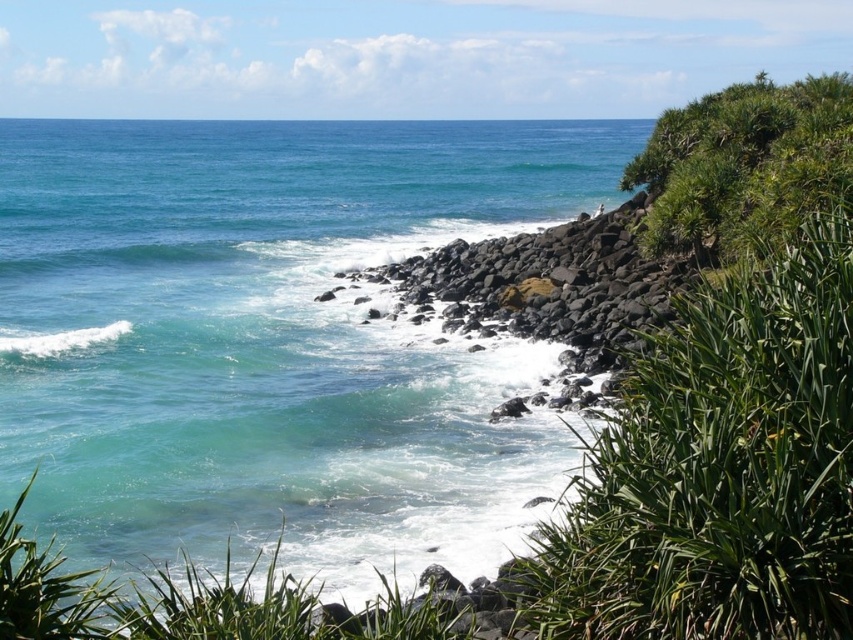
You are standing on the rocky shoreline and want to reach the green leafy plant at right. The teal water at center is between you and the plant. Can you walk directly to the plant without crossing the water?

The teal water at center is 78.12 meters away from the green leafy plant at right. Since the water is between you and the plant, you would need to walk around it or find another path to reach the plant without crossing the water.

You are a drone operator trying to capture the exact center of the teal water at center in the coastal scene. According to the coordinates provided, what are the precise 2D coordinates where you should aim your drone camera?

The precise 2D coordinates for the teal water at center are at point (273, 339).

You are standing on the rocky shoreline and want to reach the green leafy shrub at upper right. Which direction should you walk to get closer to it without entering the teal water at center?

You should walk towards the right side of the image, away from the teal water at center, as the green leafy shrub at upper right is located on the right side of the scene and the teal water at center is closer to you. Moving right will take you closer to the shrub while avoiding the water.